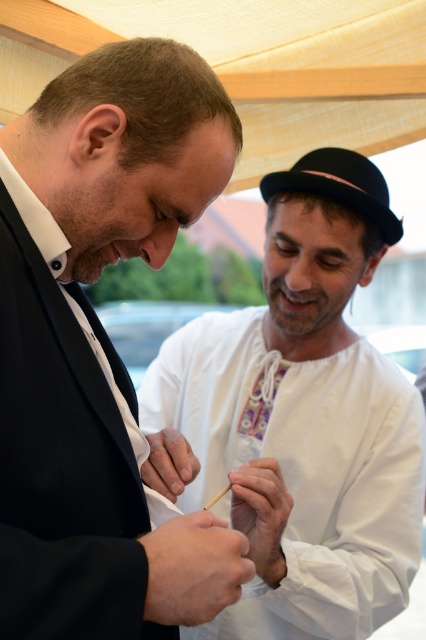
Describe the element at coordinates (305, 417) in the screenshot. I see `white embroidered shirt at center` at that location.

Find the location of a particular element. white embroidered shirt at center is located at coordinates (305, 417).

At what (x,y) coordinates should I click in order to perform the action: click on white embroidered shirt at center. Please return your answer as a coordinate pair (x, y). The width and height of the screenshot is (426, 640). Looking at the image, I should click on (305, 417).

Is point (172, 632) more distant than point (146, 467)?

No, (172, 632) is in front of (146, 467).

Based on the photo, can you confirm if black matte suit at center is positioned to the right of white embroidered shirt at center?

Incorrect, black matte suit at center is not on the right side of white embroidered shirt at center.

What do you see at coordinates (101, 349) in the screenshot?
I see `black matte suit at center` at bounding box center [101, 349].

Where is `black matte suit at center`? Image resolution: width=426 pixels, height=640 pixels. black matte suit at center is located at coordinates (101, 349).

Is black matte suit at center bigger than embroidered fabric tie at center?

Indeed, black matte suit at center has a larger size compared to embroidered fabric tie at center.

Who is more forward, [91,237] or [249,433]?

Point [91,237] is in front.

Identify the location of black matte suit at center. (101, 349).